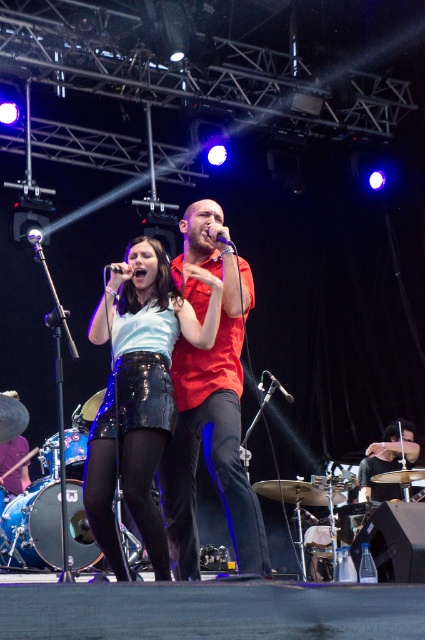
Between point (283, 388) and point (226, 241), which one is positioned in front?

Positioned in front is point (226, 241).

Is metallic silver microphone at center below black plastic microphone at center?

Indeed, metallic silver microphone at center is positioned under black plastic microphone at center.

Image resolution: width=425 pixels, height=640 pixels. What do you see at coordinates (278, 385) in the screenshot?
I see `metallic silver microphone at center` at bounding box center [278, 385].

Find the location of `metallic silver microphone at center`. metallic silver microphone at center is located at coordinates (278, 385).

Is black matte microphone at center taller than black plastic microphone at center?

Indeed, black matte microphone at center has a greater height compared to black plastic microphone at center.

Is the position of black matte microphone at center less distant than that of black plastic microphone at center?

No, it is not.

In order to click on black matte microphone at center in this screenshot , I will do `click(113, 268)`.

Which of these two, matte red shirt at center or black matte microphone at center, stands shorter?

black matte microphone at center is shorter.

In the scene shown: Can you confirm if matte red shirt at center is positioned to the right of black matte microphone at center?

Correct, you'll find matte red shirt at center to the right of black matte microphone at center.

Identify the location of matte red shirt at center. (209, 408).